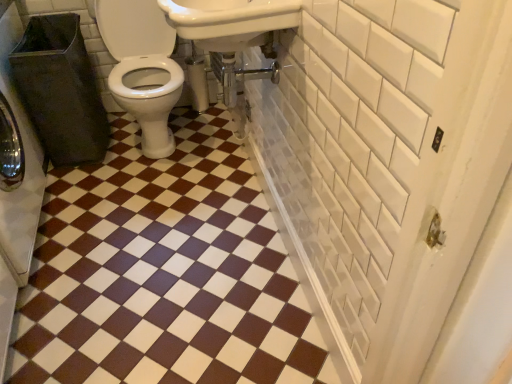
Question: Considering the relative positions of white matte toilet paper at center and white glossy sink at upper center in the image provided, is white matte toilet paper at center to the right of white glossy sink at upper center from the viewer's perspective?

Choices:
 (A) yes
 (B) no

Answer: (B)

Question: From a real-world perspective, is white matte toilet paper at center on white glossy sink at upper center?

Choices:
 (A) yes
 (B) no

Answer: (B)

Question: Considering the relative sizes of white matte toilet paper at center and white glossy sink at upper center in the image provided, is white matte toilet paper at center thinner than white glossy sink at upper center?

Choices:
 (A) no
 (B) yes

Answer: (B)

Question: Can you confirm if white matte toilet paper at center is wider than white glossy sink at upper center?

Choices:
 (A) no
 (B) yes

Answer: (A)

Question: Is white matte toilet paper at center at the left side of white glossy sink at upper center?

Choices:
 (A) yes
 (B) no

Answer: (A)

Question: Does point (259, 233) appear closer or farther from the camera than point (228, 6)?

Choices:
 (A) farther
 (B) closer

Answer: (A)

Question: Looking at the image, does brown glossy tile at center seem bigger or smaller compared to white glossy sink at upper center?

Choices:
 (A) small
 (B) big

Answer: (B)

Question: Choose the correct answer: Is brown glossy tile at center inside white glossy sink at upper center or outside it?

Choices:
 (A) outside
 (B) inside

Answer: (A)

Question: From their relative heights in the image, would you say brown glossy tile at center is taller or shorter than white glossy sink at upper center?

Choices:
 (A) tall
 (B) short

Answer: (B)

Question: From a real-world perspective, is white matte toilet paper at center above or below white glossy sink at upper center?

Choices:
 (A) above
 (B) below

Answer: (B)

Question: In terms of height, does white matte toilet paper at center look taller or shorter compared to white glossy sink at upper center?

Choices:
 (A) tall
 (B) short

Answer: (A)

Question: In terms of size, does white matte toilet paper at center appear bigger or smaller than white glossy sink at upper center?

Choices:
 (A) big
 (B) small

Answer: (B)

Question: Does point (195, 105) appear closer or farther from the camera than point (186, 16)?

Choices:
 (A) closer
 (B) farther

Answer: (B)

Question: From a real-world perspective, is brown glossy tile at center positioned above or below white matte toilet paper at center?

Choices:
 (A) above
 (B) below

Answer: (B)

Question: Visually, is brown glossy tile at center positioned to the left or to the right of white matte toilet paper at center?

Choices:
 (A) left
 (B) right

Answer: (A)